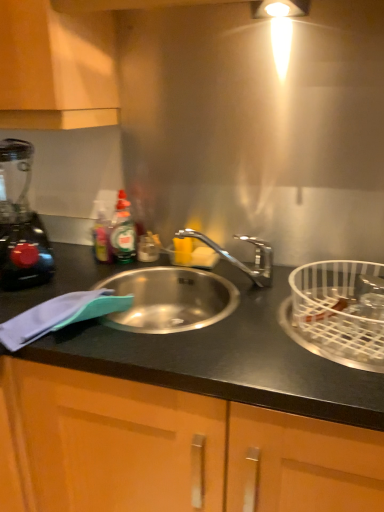
Question: Should I look upward or downward to see black matte countertop at left?

Choices:
 (A) down
 (B) up

Answer: (A)

Question: Is the surface of white wire basket at right in direct contact with black plastic blender at left?

Choices:
 (A) yes
 (B) no

Answer: (B)

Question: Is white wire basket at right thinner than black plastic blender at left?

Choices:
 (A) yes
 (B) no

Answer: (B)

Question: Considering the relative sizes of white wire basket at right and black plastic blender at left in the image provided, is white wire basket at right smaller than black plastic blender at left?

Choices:
 (A) no
 (B) yes

Answer: (A)

Question: Is white wire basket at right aimed at black plastic blender at left?

Choices:
 (A) yes
 (B) no

Answer: (B)

Question: Does white wire basket at right appear on the right side of black plastic blender at left?

Choices:
 (A) yes
 (B) no

Answer: (A)

Question: Does white wire basket at right have a larger size compared to black plastic blender at left?

Choices:
 (A) yes
 (B) no

Answer: (A)

Question: Are black plastic blender at left and black matte countertop at left located far from each other?

Choices:
 (A) no
 (B) yes

Answer: (A)

Question: From a real-world perspective, is black plastic blender at left beneath black matte countertop at left?

Choices:
 (A) no
 (B) yes

Answer: (A)

Question: Can black matte countertop at left be found inside black plastic blender at left?

Choices:
 (A) no
 (B) yes

Answer: (A)

Question: From a real-world perspective, is black plastic blender at left on top of black matte countertop at left?

Choices:
 (A) no
 (B) yes

Answer: (B)

Question: Is black plastic blender at left closer to the viewer compared to black matte countertop at left?

Choices:
 (A) no
 (B) yes

Answer: (A)

Question: Considering the relative positions of black plastic blender at left and black matte countertop at left in the image provided, is black plastic blender at left to the right of black matte countertop at left from the viewer's perspective?

Choices:
 (A) no
 (B) yes

Answer: (A)

Question: From a real-world perspective, is black plastic blender at left physically below white wire basket at right?

Choices:
 (A) no
 (B) yes

Answer: (A)